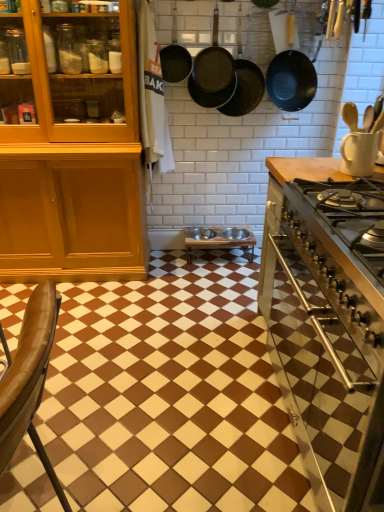
This screenshot has width=384, height=512. Find the location of `vacant space to the left of wooden table at center`. vacant space to the left of wooden table at center is located at coordinates (173, 265).